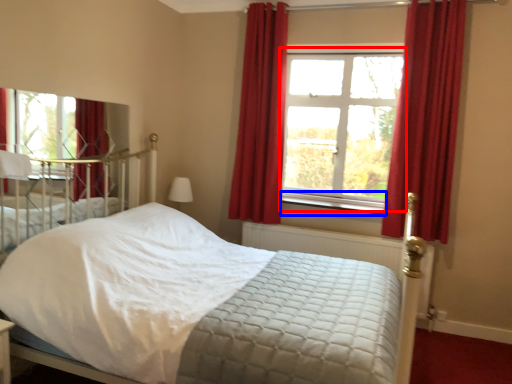
Question: Which object is closer to the camera taking this photo, window (highlighted by a red box) or window sill (highlighted by a blue box)?

Choices:
 (A) window
 (B) window sill

Answer: (B)